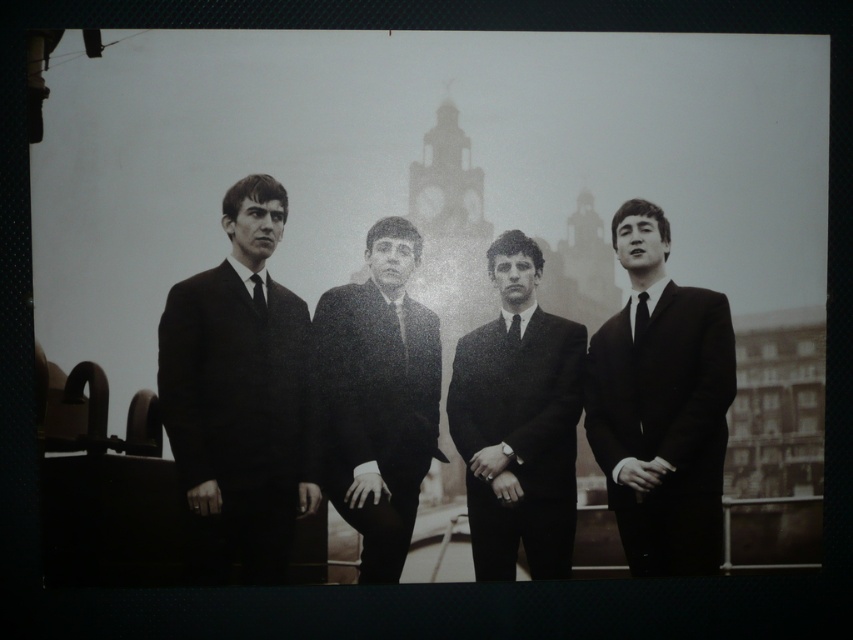
Is matte black suit at right thinner than matte black suit at center?

Incorrect, matte black suit at right's width is not less than matte black suit at center's.

Is point (630, 276) in front of point (560, 486)?

Yes, it is in front of point (560, 486).

Find the location of a particular element. The image size is (853, 640). matte black suit at right is located at coordinates (660, 406).

This screenshot has height=640, width=853. I want to click on matte black suit at right, so click(660, 406).

Identify the location of matte black suit at right. This screenshot has height=640, width=853. (660, 406).

Where is `matte black suit at right`? This screenshot has height=640, width=853. matte black suit at right is located at coordinates (660, 406).

The image size is (853, 640). In order to click on matte black suit at center in this screenshot , I will do `click(518, 422)`.

Is matte black suit at center wider than black silk tie at center?

Yes.

Who is more distant from viewer, [523,300] or [514,316]?

Point [514,316]

What are the coordinates of `matte black suit at center` in the screenshot? It's located at (518, 422).